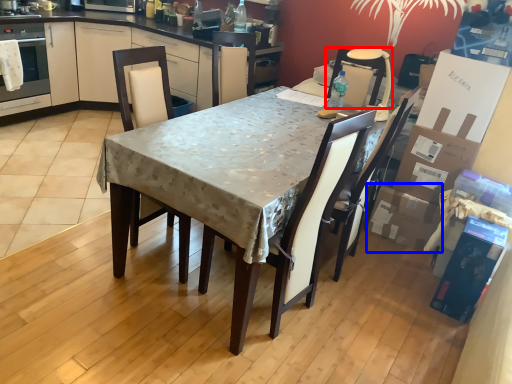
Question: Which of the following is the closest to the observer, chair (highlighted by a red box) or cardboard box (highlighted by a blue box)?

Choices:
 (A) chair
 (B) cardboard box

Answer: (A)